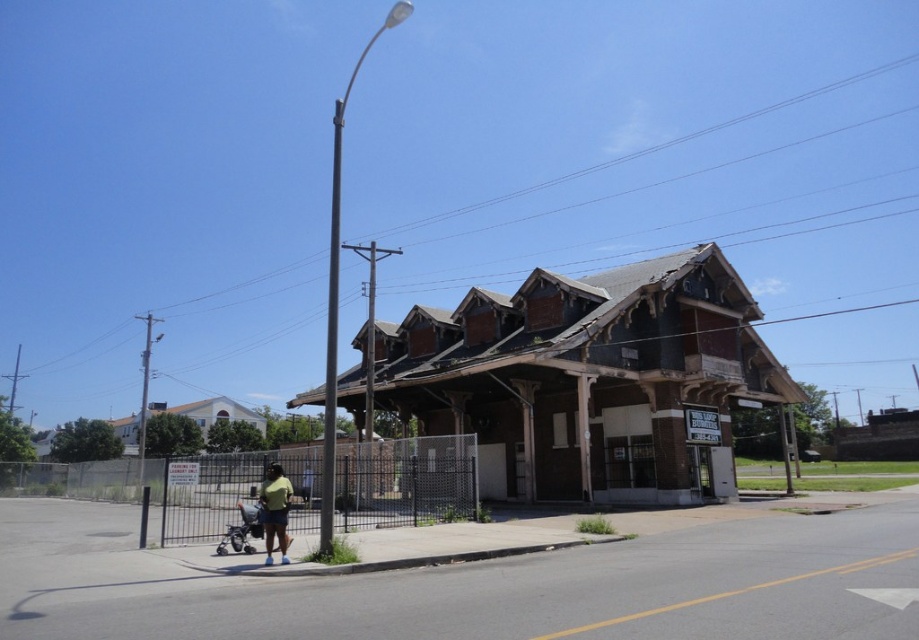
Which of these two, green matte shirt at lower center or silver metallic stroller at lower left, stands taller?

With more height is silver metallic stroller at lower left.

Can you confirm if green matte shirt at lower center is wider than silver metallic stroller at lower left?

No, green matte shirt at lower center is not wider than silver metallic stroller at lower left.

This screenshot has width=919, height=640. In order to click on green matte shirt at lower center in this screenshot , I will do `click(275, 512)`.

Find the location of a particular element. Image resolution: width=919 pixels, height=640 pixels. green matte shirt at lower center is located at coordinates (275, 512).

Can you confirm if smooth gray pole at center is wider than green matte shirt at lower center?

Yes, smooth gray pole at center is wider than green matte shirt at lower center.

Can you confirm if smooth gray pole at center is bigger than green matte shirt at lower center?

Correct, smooth gray pole at center is larger in size than green matte shirt at lower center.

Identify the location of smooth gray pole at center. (331, 342).

Between smooth gray pole at center and silver metallic stroller at lower left, which one has less height?

silver metallic stroller at lower left is shorter.

Does smooth gray pole at center appear under silver metallic stroller at lower left?

Actually, smooth gray pole at center is above silver metallic stroller at lower left.

This screenshot has width=919, height=640. In order to click on smooth gray pole at center in this screenshot , I will do `click(331, 342)`.